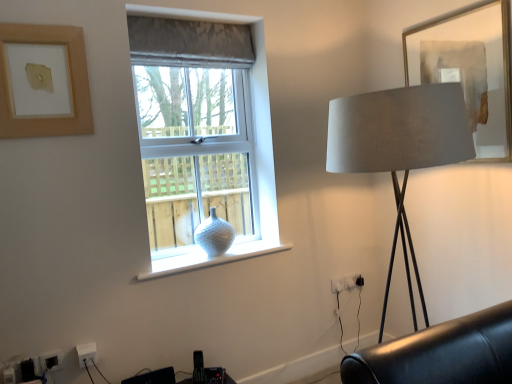
Locate an element on the screen. This screenshot has height=384, width=512. free area in between white glossy vase at window and white textured vase at center is located at coordinates (222, 261).